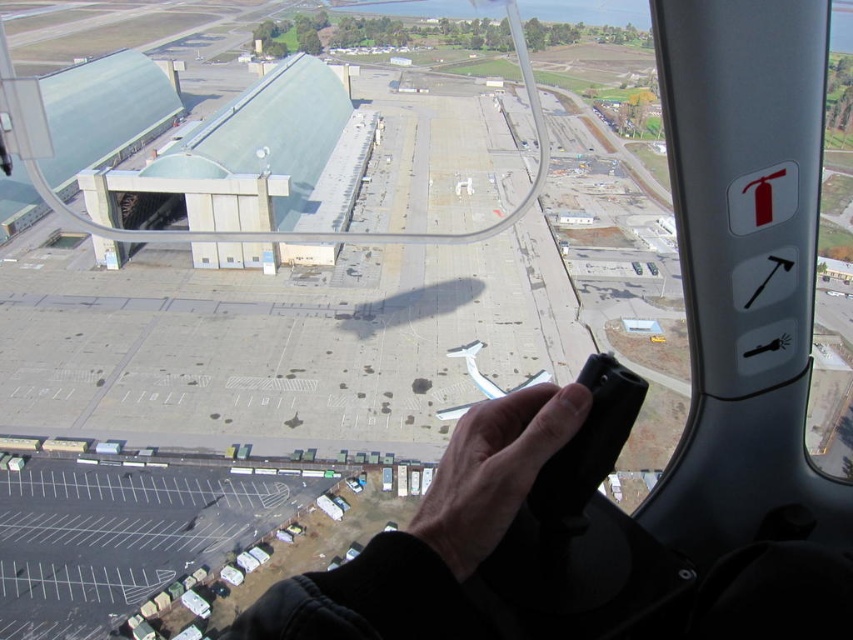
Question: Does black matte remote control at center have a smaller size compared to light skin tone hand at center?

Choices:
 (A) yes
 (B) no

Answer: (A)

Question: Does black matte remote control at center have a greater width compared to light skin tone hand at center?

Choices:
 (A) no
 (B) yes

Answer: (A)

Question: Which object appears farthest from the camera in this image?

Choices:
 (A) light skin tone hand at center
 (B) black matte remote control at center

Answer: (A)

Question: Which point is farther from the camera taking this photo?

Choices:
 (A) (498, 401)
 (B) (474, 467)

Answer: (A)

Question: Is the position of black matte remote control at center more distant than that of light skin tone hand at center?

Choices:
 (A) no
 (B) yes

Answer: (A)